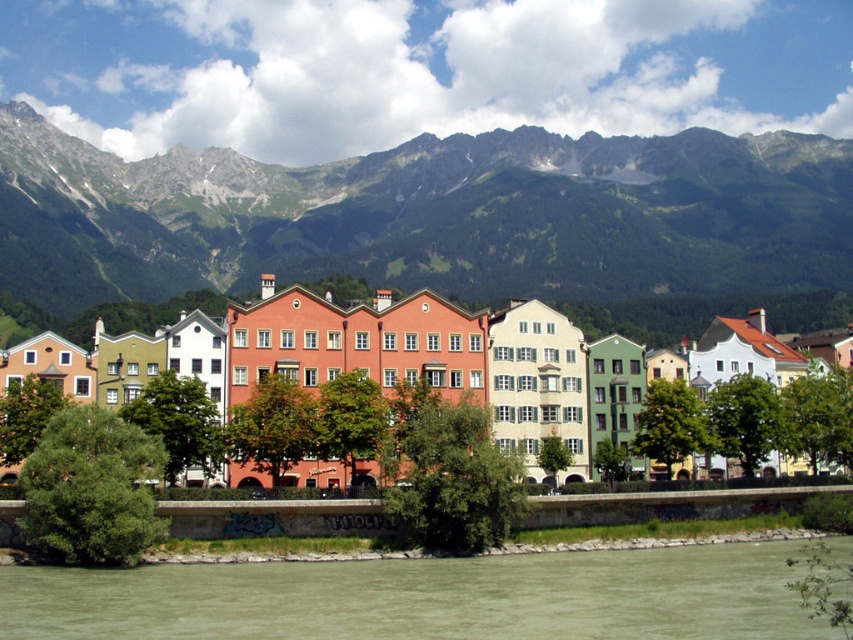
You are standing at the point labeled point (428, 216) in the image. What do you see in front of you?

You see green rocky mountains at upper center in front of you.